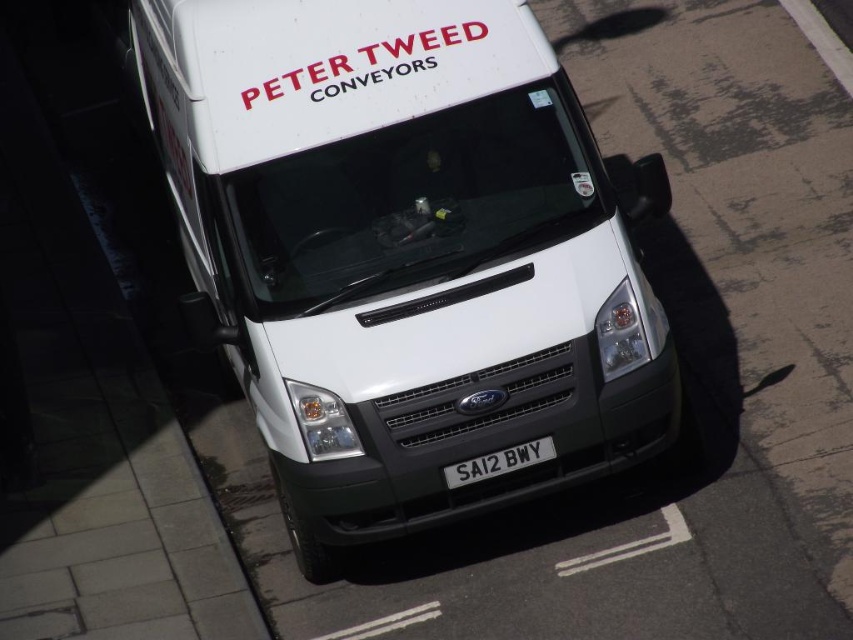
Question: Which of the following is the closest to the observer?

Choices:
 (A) (506, 451)
 (B) (338, 355)

Answer: (B)

Question: Is white matte van at center further to camera compared to white metallic license plate at center?

Choices:
 (A) yes
 (B) no

Answer: (B)

Question: Does white matte van at center have a greater width compared to white metallic license plate at center?

Choices:
 (A) yes
 (B) no

Answer: (A)

Question: Is white matte van at center closer to camera compared to white metallic license plate at center?

Choices:
 (A) no
 (B) yes

Answer: (B)